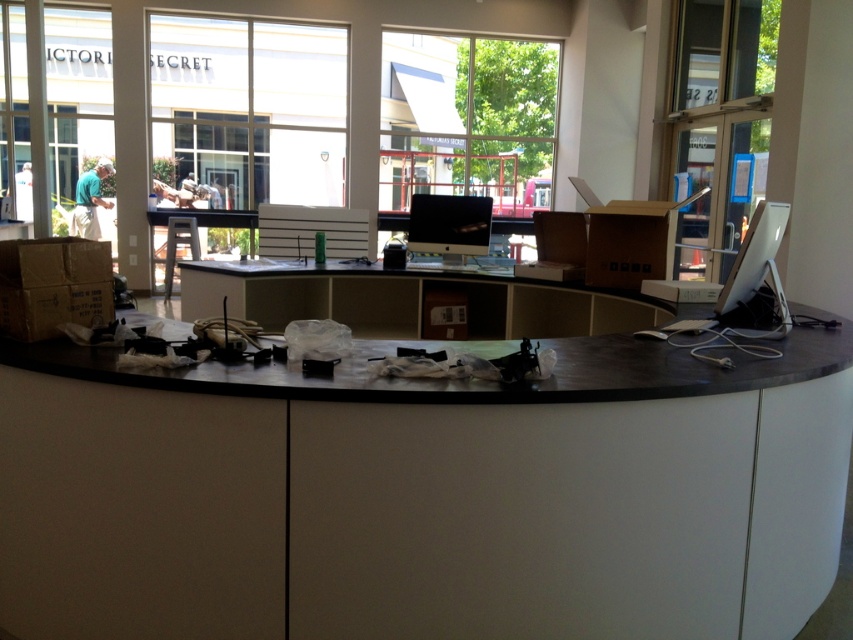
Who is higher up, matte black desk at center or satin silver monitor at right?

satin silver monitor at right

Consider the image. Which of these two, matte black desk at center or satin silver monitor at right, stands taller?

With more height is matte black desk at center.

Is point (573, 317) farther from camera compared to point (751, 234)?

Yes, it is behind point (751, 234).

Locate an element on the screen. matte black desk at center is located at coordinates (405, 300).

Does black matte desk at center come behind matte black desk at center?

No, it is not.

Does black matte desk at center appear on the right side of matte black desk at center?

Correct, you'll find black matte desk at center to the right of matte black desk at center.

Who is more distant from viewer, [262,579] or [486,288]?

The point [486,288] is behind.

You are a GUI agent. You are given a task and a screenshot of the screen. Output one action in this format:
    pyautogui.click(x=<x>, y=<y>)
    Task: Click on the black matte desk at center
    The width and height of the screenshot is (853, 640).
    Given the screenshot: What is the action you would take?
    pyautogui.click(x=416, y=513)

Can you confirm if matte black desk at center is taller than sleek black monitor at center?

In fact, matte black desk at center may be shorter than sleek black monitor at center.

Which of these two, matte black desk at center or sleek black monitor at center, stands taller?

With more height is sleek black monitor at center.

Between point (492, 285) and point (444, 209), which one is positioned in front?

Point (492, 285)

Locate an element on the screen. matte black desk at center is located at coordinates (405, 300).